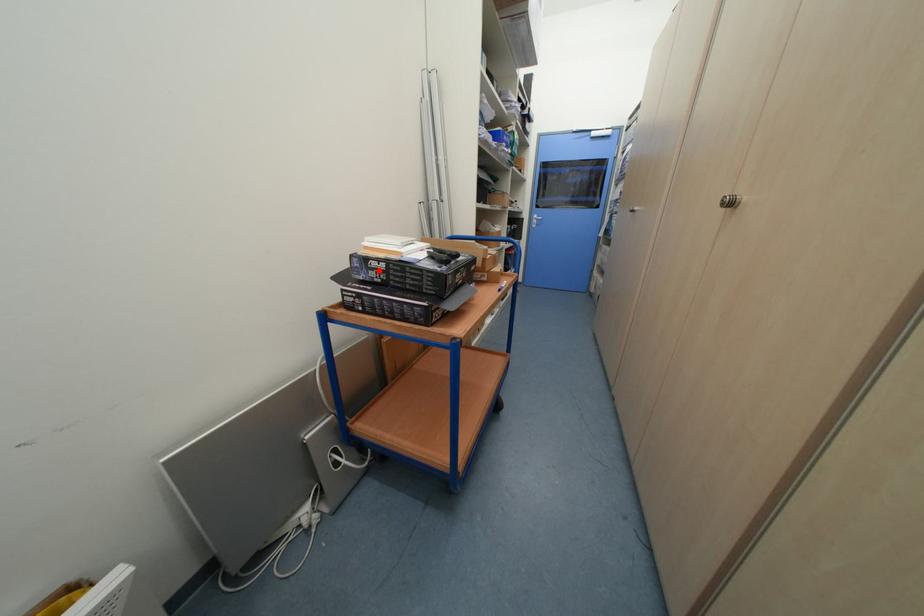
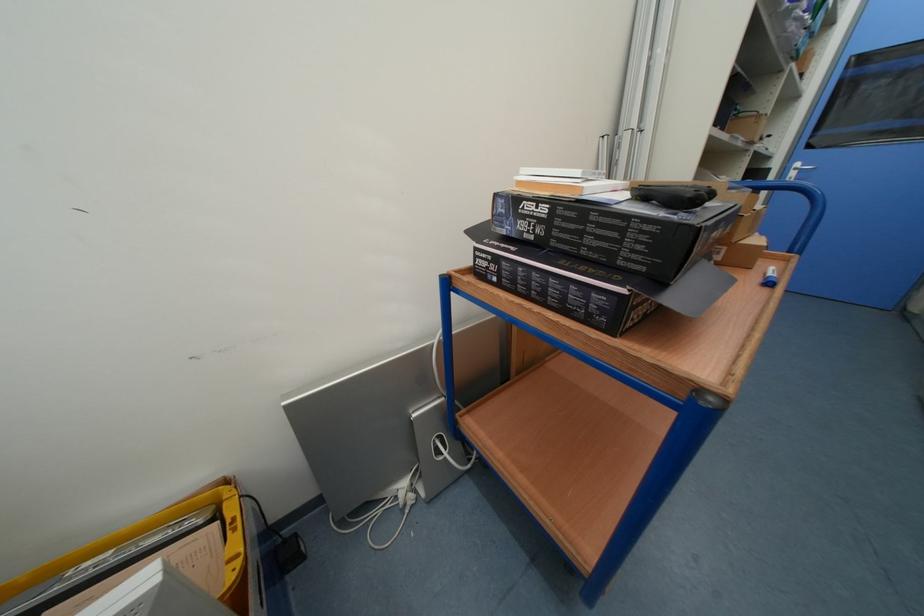
Find the pixel in the second image that matches the highlighted location in the first image.

(530, 217)